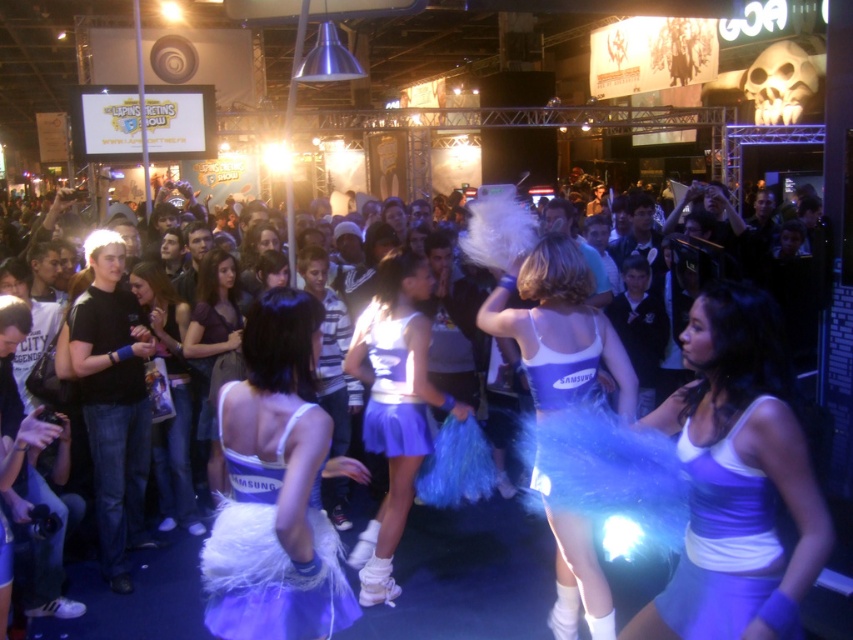
Question: Can you confirm if matte blue tutu at center is positioned below matte purple tutu at center?

Choices:
 (A) yes
 (B) no

Answer: (A)

Question: Which object appears closest to the camera in this image?

Choices:
 (A) white fluffy pom-poms at center
 (B) white satin dress at center

Answer: (B)

Question: Does matte blue tutu at center appear on the left side of matte purple tutu at center?

Choices:
 (A) no
 (B) yes

Answer: (A)

Question: Which of the following is the farthest from the observer?

Choices:
 (A) (221, 604)
 (B) (109, 600)

Answer: (B)

Question: Which point is closer to the camera?

Choices:
 (A) (705, 548)
 (B) (177, 628)
 (C) (403, 323)

Answer: (A)

Question: Is white fluffy pom-poms at center further to camera compared to matte purple tutu at center?

Choices:
 (A) yes
 (B) no

Answer: (B)